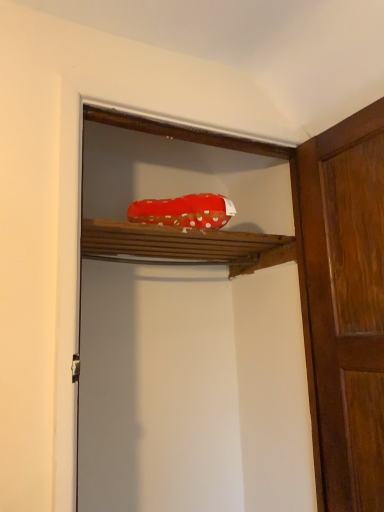
Question: Is red polka dot fabric at upper center completely or partially outside of red fabric shoe at upper center?

Choices:
 (A) no
 (B) yes

Answer: (A)

Question: Can you confirm if red polka dot fabric at upper center is wider than red fabric shoe at upper center?

Choices:
 (A) yes
 (B) no

Answer: (A)

Question: Is red polka dot fabric at upper center to the left of red fabric shoe at upper center from the viewer's perspective?

Choices:
 (A) no
 (B) yes

Answer: (B)

Question: From the image's perspective, is red polka dot fabric at upper center on top of red fabric shoe at upper center?

Choices:
 (A) no
 (B) yes

Answer: (B)

Question: From a real-world perspective, does red polka dot fabric at upper center stand above red fabric shoe at upper center?

Choices:
 (A) yes
 (B) no

Answer: (A)

Question: From a real-world perspective, is wooden door at right positioned above or below red polka dot fabric at upper center?

Choices:
 (A) above
 (B) below

Answer: (B)

Question: Choose the correct answer: Is wooden door at right inside red polka dot fabric at upper center or outside it?

Choices:
 (A) inside
 (B) outside

Answer: (B)

Question: From the image's perspective, relative to red polka dot fabric at upper center, is wooden door at right above or below?

Choices:
 (A) above
 (B) below

Answer: (B)

Question: Based on their sizes in the image, would you say wooden door at right is bigger or smaller than red polka dot fabric at upper center?

Choices:
 (A) big
 (B) small

Answer: (A)

Question: In terms of size, does red polka dot fabric at upper center appear bigger or smaller than red fabric shoe at upper center?

Choices:
 (A) small
 (B) big

Answer: (A)

Question: In terms of width, does red polka dot fabric at upper center look wider or thinner when compared to red fabric shoe at upper center?

Choices:
 (A) thin
 (B) wide

Answer: (B)

Question: Considering the positions of red polka dot fabric at upper center and red fabric shoe at upper center in the image, is red polka dot fabric at upper center taller or shorter than red fabric shoe at upper center?

Choices:
 (A) tall
 (B) short

Answer: (B)

Question: Relative to red fabric shoe at upper center, is red polka dot fabric at upper center in front or behind?

Choices:
 (A) front
 (B) behind

Answer: (B)

Question: Is point (147, 292) positioned closer to the camera than point (362, 238)?

Choices:
 (A) farther
 (B) closer

Answer: (A)

Question: Based on their positions, is red fabric shoe at upper center located to the left or right of wooden door at right?

Choices:
 (A) left
 (B) right

Answer: (A)